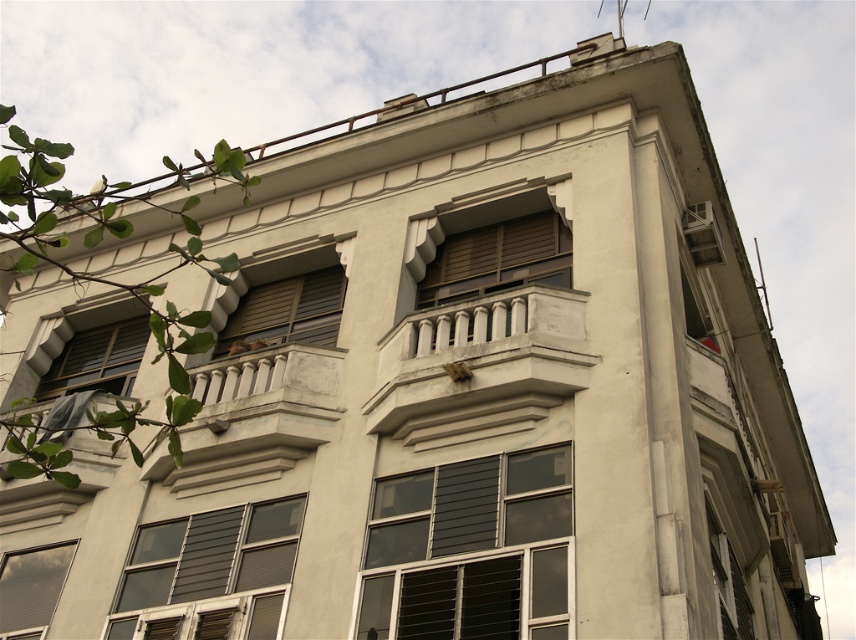
You are standing in front of the building and want to locate the clear glass window at center. Which direction should you look relative to the point marked at coordinates point [470,550]?

The clear glass window at center is exactly at the point marked at coordinates point [470,550], so you should look directly at that point to locate it.

You are a window installer working on the building. You need to place a new window that is 2 meters wide between the clear glass window at center and the matte glass window at lower left. Is there enough space between them to fit the new window?

The clear glass window at center is 19.07 meters from the matte glass window at lower left. Since the new window is only 2 meters wide, there is more than enough space between them to accommodate it.

You are standing at the entrance of the multi story building and want to reach the white concrete balcony at center. Which direction should you go to reach it?

The white concrete balcony at center is located at point (x=254, y=419), so you should move towards the center of the building to reach it.